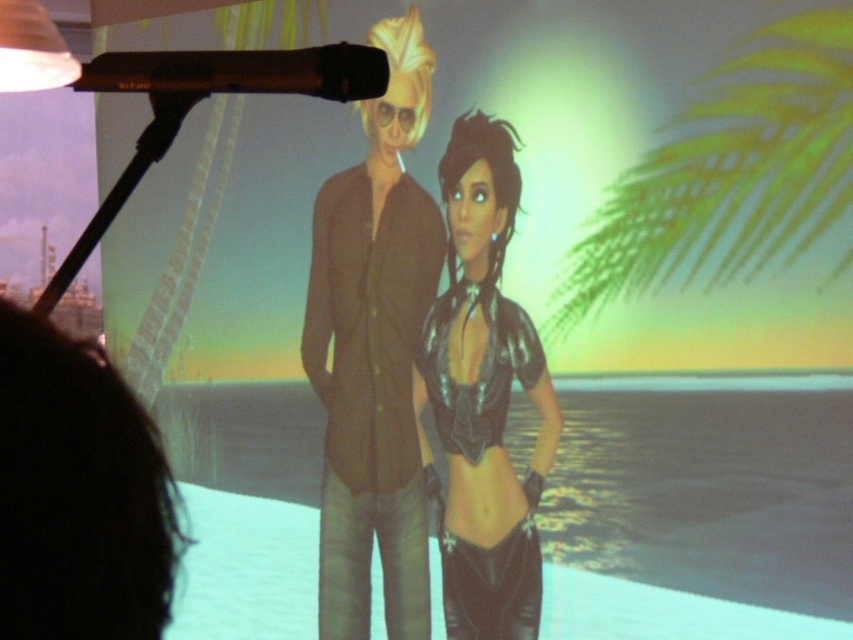
Between point (378, 154) and point (450, 595), which one is positioned behind?

The point (378, 154) is more distant.

From the picture: Who is taller, matte brown shirt at center or shiny metallic top at center?

With more height is matte brown shirt at center.

What are the coordinates of `matte brown shirt at center` in the screenshot? It's located at (375, 353).

Can you confirm if matte brown shirt at center is shorter than matte white lampshade at upper left?

No.

Does matte brown shirt at center have a lesser width compared to matte white lampshade at upper left?

Yes.

What do you see at coordinates (375, 353) in the screenshot? I see `matte brown shirt at center` at bounding box center [375, 353].

This screenshot has height=640, width=853. I want to click on matte brown shirt at center, so click(375, 353).

Looking at this image, who is positioned more to the right, black matte microphone at upper left or matte white lampshade at upper left?

From the viewer's perspective, black matte microphone at upper left appears more on the right side.

Can you confirm if black matte microphone at upper left is taller than matte white lampshade at upper left?

Incorrect, black matte microphone at upper left's height is not larger of matte white lampshade at upper left's.

What do you see at coordinates (241, 72) in the screenshot?
I see `black matte microphone at upper left` at bounding box center [241, 72].

Where is `black matte microphone at upper left`? The image size is (853, 640). black matte microphone at upper left is located at coordinates (241, 72).